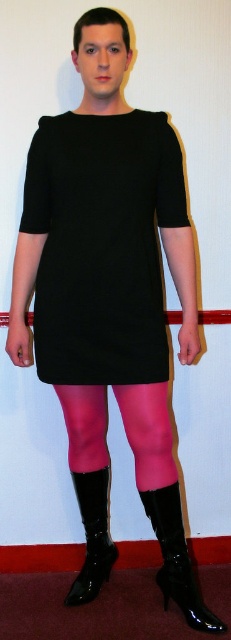
Does black matte dress at center have a lesser width compared to glossy patent leather boot at lower center?

Incorrect, black matte dress at center's width is not less than glossy patent leather boot at lower center's.

This screenshot has height=640, width=231. What do you see at coordinates (102, 244) in the screenshot? I see `black matte dress at center` at bounding box center [102, 244].

Which is behind, point (116, 230) or point (170, 486)?

Positioned behind is point (170, 486).

Locate an element on the screen. black matte dress at center is located at coordinates (102, 244).

Is point (114, 308) behind point (69, 600)?

No.

Can you confirm if black matte dress at center is positioned above black patent leather boot at lower center?

Indeed, black matte dress at center is positioned over black patent leather boot at lower center.

Is point (146, 268) closer to camera compared to point (100, 476)?

Yes, point (146, 268) is in front of point (100, 476).

Identify the location of black matte dress at center. (102, 244).

Can you confirm if pink sheer tights at lower center is thinner than black patent leather boot at lower center?

No, pink sheer tights at lower center is not thinner than black patent leather boot at lower center.

Between pink sheer tights at lower center and black patent leather boot at lower center, which one is positioned lower?

black patent leather boot at lower center is lower down.

You are a GUI agent. You are given a task and a screenshot of the screen. Output one action in this format:
    pyautogui.click(x=<x>, y=<y>)
    Task: Click on the pink sheer tights at lower center
    
    Given the screenshot: What is the action you would take?
    pyautogui.click(x=148, y=433)